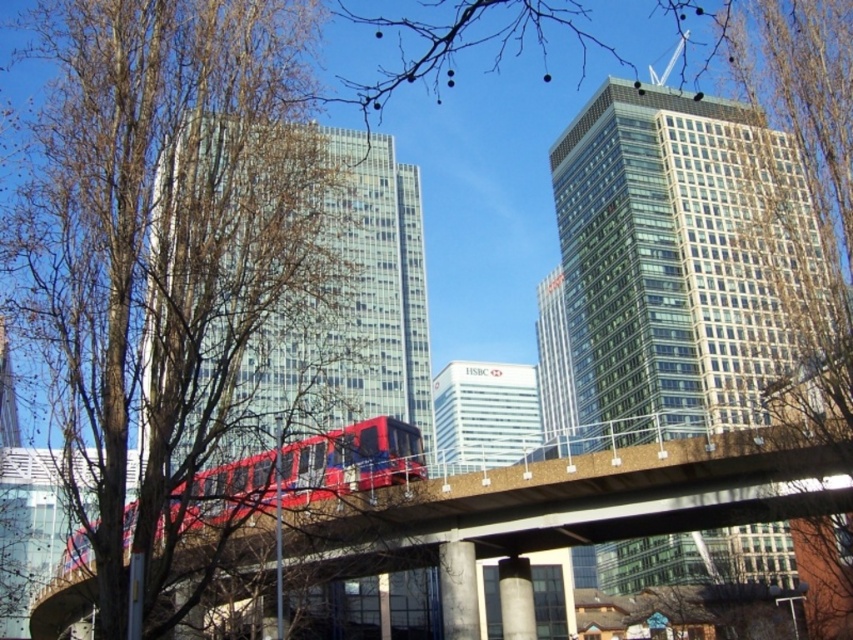
You are standing at the center of the image and want to take a photo of the brown leafless tree at left. Which direction should you turn to face the tree?

The brown leafless tree at left is located at point (165, 241), which is to the left side of the image. Therefore, you should turn to your left to face the tree.

You are standing in the urban scene and want to reach a specific point marked as point (241,148). If your current position is 50 meters away from that point, can you safely walk towards it without moving closer than 2 meters? Please explain your reasoning.

The point (241,148) is 51.95 meters away from the viewer. Since you are currently 50 meters away, you are already closer than the 51.95 meters distance. To maintain a minimum distance of 2 meters, you would need to stay at least 53.95 meters away. However, since you are already closer, you cannot safely walk towards it without violating the 2 meter minimum distance requirement.